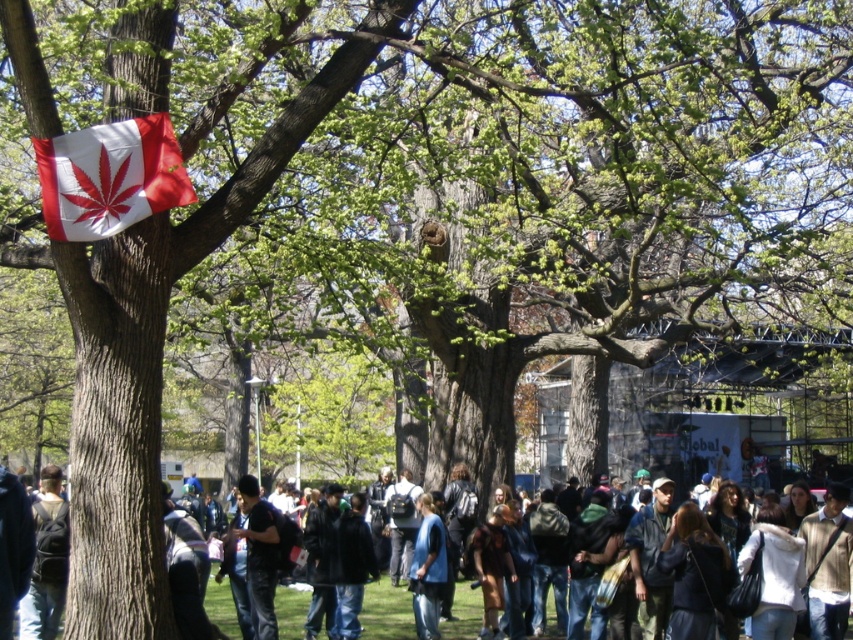
Question: Which of the following is the farthest from the observer?

Choices:
 (A) dark blue jeans at center
 (B) dark gray fabric jacket at center
 (C) dark blue jeans at lower left

Answer: (A)

Question: Does dark blue jeans at center have a lesser width compared to dark blue jeans at lower left?

Choices:
 (A) no
 (B) yes

Answer: (A)

Question: Which object appears farthest from the camera in this image?

Choices:
 (A) dark gray fabric jacket at center
 (B) white fabric flag at upper left

Answer: (A)

Question: Which point is closer to the camera?

Choices:
 (A) dark gray fabric jacket at center
 (B) dark blue jeans at center
 (C) white fabric flag at upper left
 (D) dark blue jeans at lower left

Answer: (C)

Question: In this image, where is dark blue jeans at center located relative to dark blue jeans at lower left?

Choices:
 (A) right
 (B) left

Answer: (A)

Question: Does dark blue jeans at lower left appear on the right side of dark gray fabric jacket at center?

Choices:
 (A) yes
 (B) no

Answer: (B)